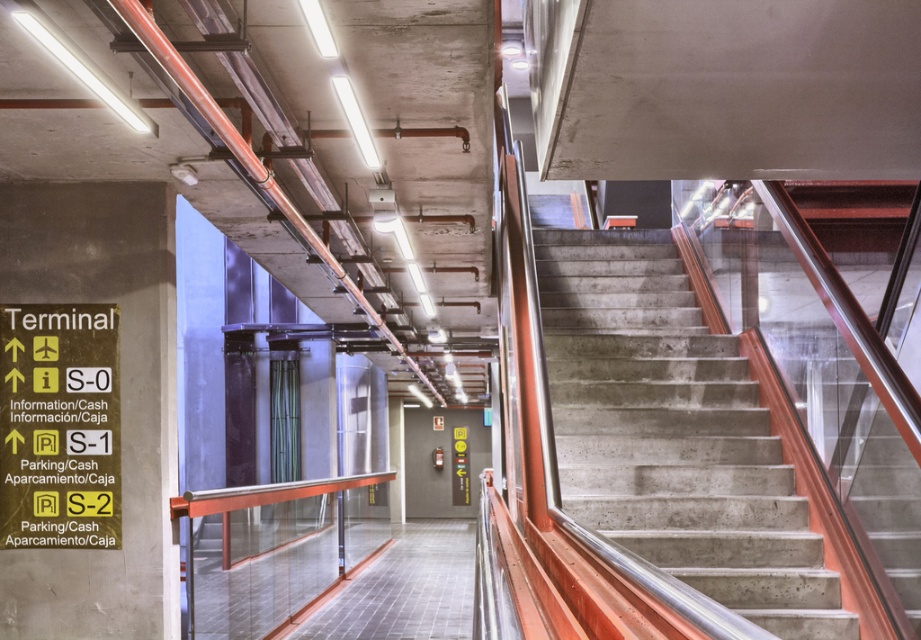
Based on the scene description, where is the point located at coordinates (673, 433)?

The point at coordinates (673, 433) is located on the concrete stairs at center.